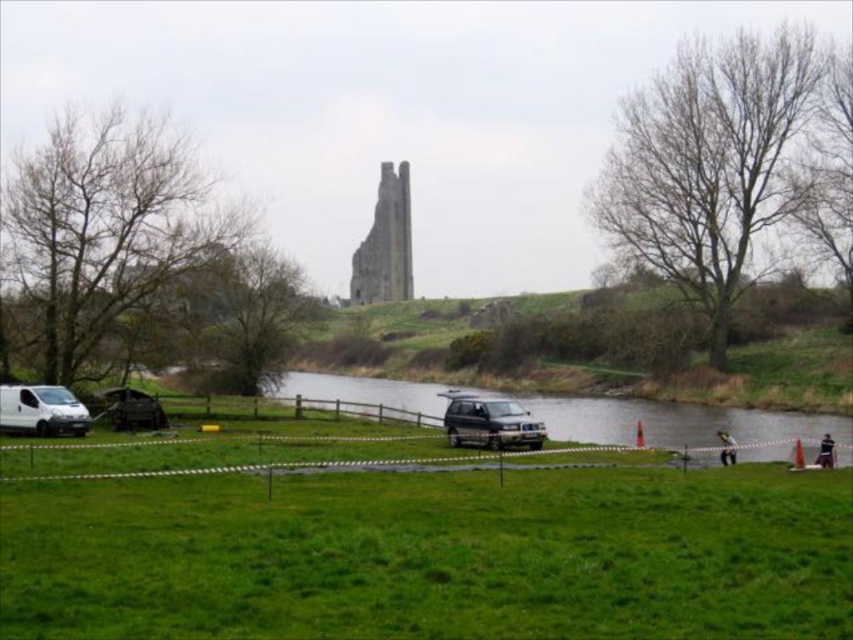
You are a photographer setting up a tripod to capture the stone structure in the background. You have two vehicles in your frame, the satin silver suv at center and the metallic dark gray suv at lower left. To ensure both vehicles are visible but not blocking the stone structure, which vehicle should you position your tripod closer to?

You should position your tripod closer to the metallic dark gray suv at lower left because the satin silver suv at center is on the right side of it, so placing the tripod near the metallic dark gray suv would keep both vehicles in the frame while keeping them away from the central focus on the stone structure.

You are a photographer standing at the edge of the green grass at center and want to take a picture of the white matte van at lower left. Based on their positions, will the van be visible in the frame if you point your camera upwards?

The green grass at center is located below the white matte van at lower left, so pointing the camera upwards from the grass would allow you to see the van.

You are a photographer planning to capture a landscape shot of the stone tower in the background. You have two vehicles in the scene, the satin silver suv at center and the metallic dark gray suv at lower left. Which vehicle is positioned higher up in the frame, potentially blocking the view of the tower?

The satin silver suv at center is positioned higher up in the frame than the metallic dark gray suv at lower left, so it might block the view of the tower.